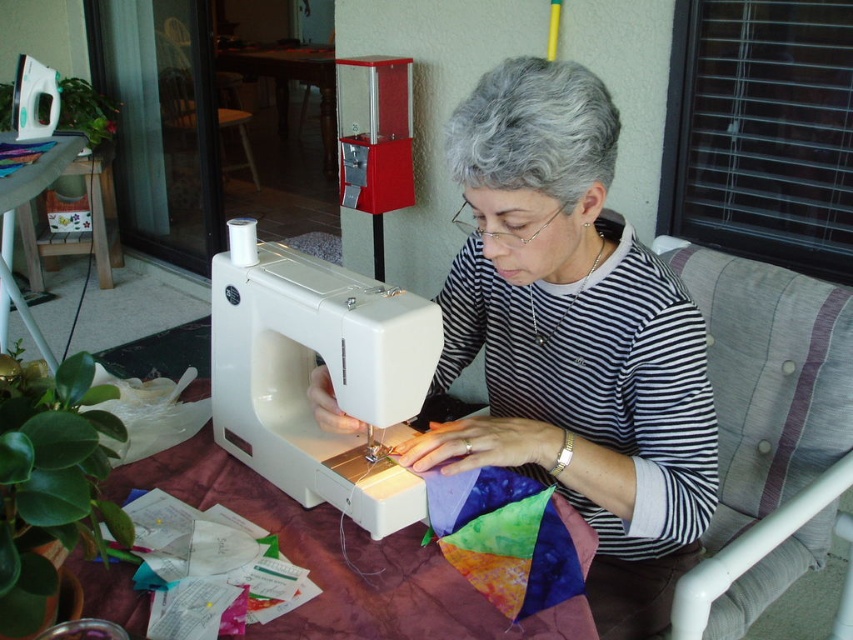
Who is taller, striped fabric shirt at center or white plastic sewing machine at center?

Standing taller between the two is striped fabric shirt at center.

Can you confirm if striped fabric shirt at center is taller than white plastic sewing machine at center?

Yes, striped fabric shirt at center is taller than white plastic sewing machine at center.

This screenshot has width=853, height=640. Describe the element at coordinates (573, 339) in the screenshot. I see `striped fabric shirt at center` at that location.

Locate an element on the screen. This screenshot has height=640, width=853. striped fabric shirt at center is located at coordinates (573, 339).